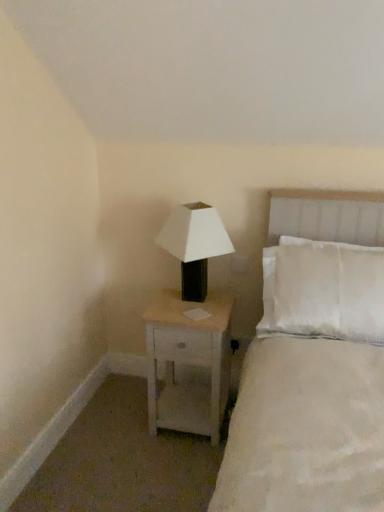
Question: Is white matte/black plastic lamp at upper right at the right side of white wood nightstand at center?

Choices:
 (A) no
 (B) yes

Answer: (B)

Question: Does white matte/black plastic lamp at upper right have a lesser height compared to white wood nightstand at center?

Choices:
 (A) no
 (B) yes

Answer: (B)

Question: Is white matte/black plastic lamp at upper right positioned with its back to white wood nightstand at center?

Choices:
 (A) no
 (B) yes

Answer: (A)

Question: Does white matte/black plastic lamp at upper right come in front of white wood nightstand at center?

Choices:
 (A) yes
 (B) no

Answer: (A)

Question: From a real-world perspective, is white matte/black plastic lamp at upper right on white wood nightstand at center?

Choices:
 (A) no
 (B) yes

Answer: (B)

Question: In terms of size, does white soft bed at upper right appear bigger or smaller than white matte/black plastic lamp at upper right?

Choices:
 (A) small
 (B) big

Answer: (B)

Question: From the image's perspective, is white soft bed at upper right positioned above or below white matte/black plastic lamp at upper right?

Choices:
 (A) below
 (B) above

Answer: (A)

Question: From a real-world perspective, is white soft bed at upper right positioned above or below white matte/black plastic lamp at upper right?

Choices:
 (A) below
 (B) above

Answer: (A)

Question: In the image, is white soft bed at upper right positioned in front of or behind white matte/black plastic lamp at upper right?

Choices:
 (A) front
 (B) behind

Answer: (A)

Question: From a real-world perspective, is white soft bed at upper right above or below white wood nightstand at center?

Choices:
 (A) below
 (B) above

Answer: (B)

Question: Is white soft bed at upper right to the left or to the right of white wood nightstand at center in the image?

Choices:
 (A) left
 (B) right

Answer: (B)

Question: Considering the positions of white soft bed at upper right and white wood nightstand at center in the image, is white soft bed at upper right bigger or smaller than white wood nightstand at center?

Choices:
 (A) small
 (B) big

Answer: (B)

Question: Is white soft bed at upper right inside or outside of white wood nightstand at center?

Choices:
 (A) inside
 (B) outside

Answer: (B)

Question: Is white wood nightstand at center to the left or to the right of white matte/black plastic lamp at upper right in the image?

Choices:
 (A) left
 (B) right

Answer: (A)

Question: From the image's perspective, is white wood nightstand at center above or below white matte/black plastic lamp at upper right?

Choices:
 (A) above
 (B) below

Answer: (B)